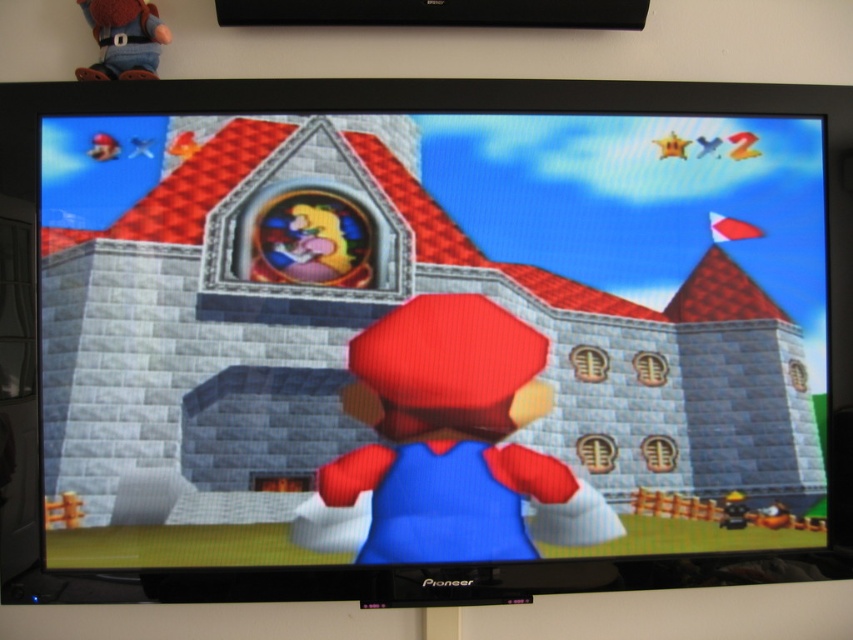
You are a character in the game who needs to jump from the matte denim doll at upper left to reach the matte blue fabric mario at center. Considering the distance between them is 23.12 inches, can you make the jump if your maximum jump distance is 24 inches?

The distance between the matte blue fabric mario at center and the matte denim doll at upper left is 23.12 inches. Since your maximum jump distance is 24 inches, you can successfully make the jump.